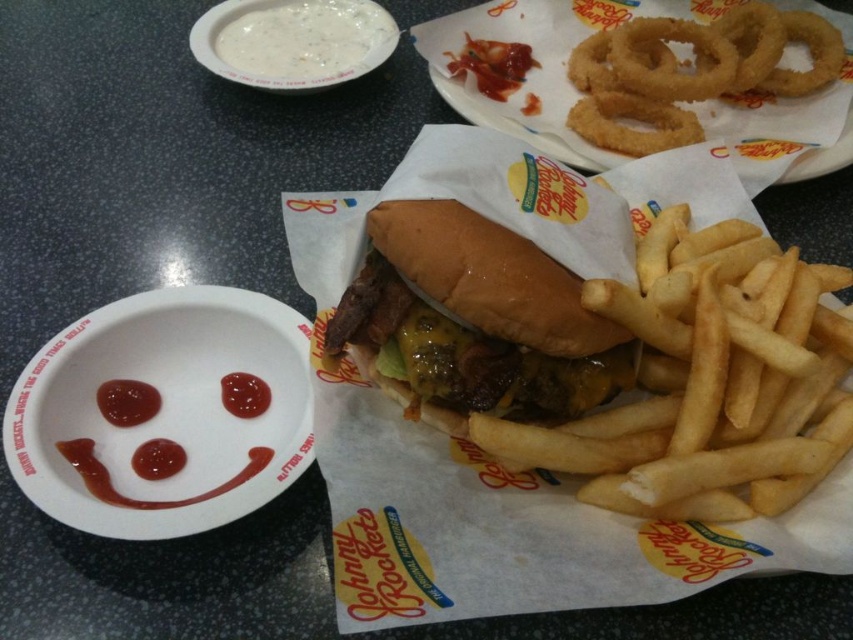
You are a food critic evaluating this Johnny Rockets meal. You notice the matte white paper plate at lower left and the slightly toasted bun at center. Based on their positions, which one is located lower in the image?

The matte white paper plate at lower left is located lower than the slightly toasted bun at center in the image.

You are a food critic evaluating the presentation of this Johnny Rockets meal. Which item has a smaller vertical size between the matte white paper plate at lower left and the golden brown fried onion rings at upper center?

The matte white paper plate at lower left has a lesser height compared to the golden brown fried onion rings at upper center, so the matte white paper plate at lower left is smaller in vertical size.

You are a customer at Johnny Rockets who wants to dip the golden brown fried onion rings at upper center into the white matte bowl at upper left. Can you reach the bowl without moving the burger?

The white matte bowl at upper left is positioned over golden brown fried onion rings at upper center, so you can easily reach the bowl by moving your hand slightly downward from the onion rings to the bowl below.